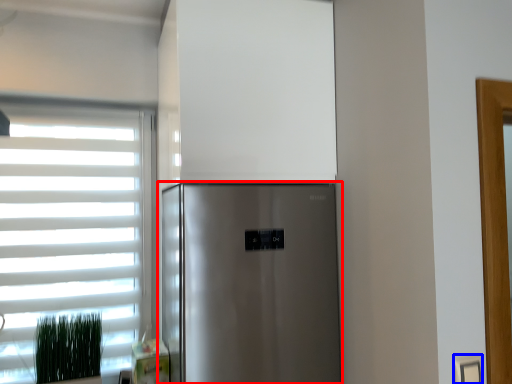
Question: Which object is closer to the camera taking this photo, refrigerator (highlighted by a red box) or electric outlet (highlighted by a blue box)?

Choices:
 (A) refrigerator
 (B) electric outlet

Answer: (B)